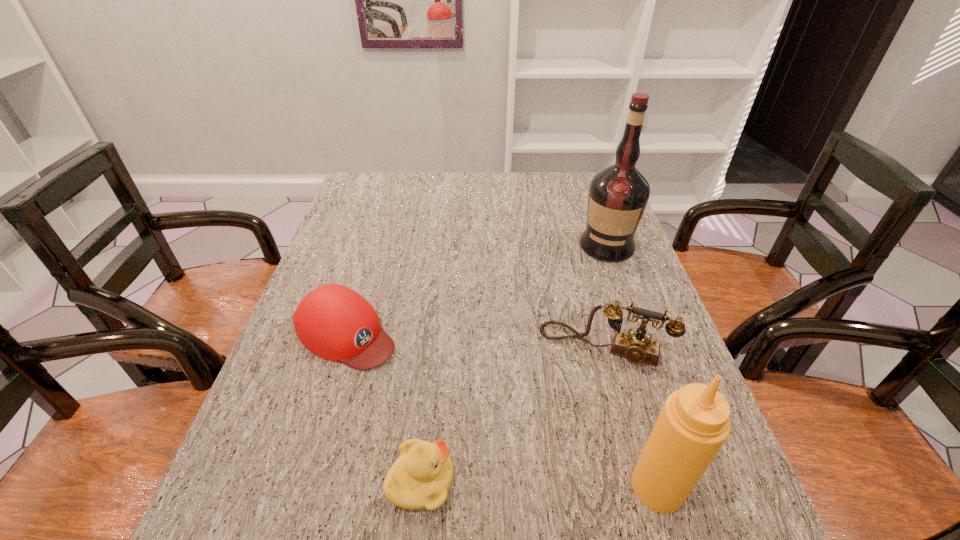
The image size is (960, 540). I want to click on duckling, so click(x=421, y=476).

At what (x,y) coordinates should I click in order to perform the action: click on condiment. Please return your answer as a coordinate pair (x, y). The height and width of the screenshot is (540, 960). Looking at the image, I should click on (694, 423).

This screenshot has width=960, height=540. I want to click on telephone, so click(x=636, y=347).

The height and width of the screenshot is (540, 960). I want to click on the farthest object, so (618, 195).

This screenshot has height=540, width=960. I want to click on liquor, so click(618, 195).

The height and width of the screenshot is (540, 960). Find the location of `baseball cap`. baseball cap is located at coordinates click(x=334, y=322).

Locate an element on the screen. This screenshot has height=540, width=960. free space located on the front-facing side of the duckling is located at coordinates (623, 481).

Locate an element on the screen. The width and height of the screenshot is (960, 540). vacant space situated 0.090m on the back of the condiment is located at coordinates (637, 418).

Where is `vacant space positioned on the front-facing side of the third shortest object`? This screenshot has height=540, width=960. vacant space positioned on the front-facing side of the third shortest object is located at coordinates (568, 437).

At what (x,y) coordinates should I click in order to perform the action: click on free space located 0.280m on the front-facing side of the third shortest object. Please return your answer as a coordinate pair (x, y). Looking at the image, I should click on (556, 486).